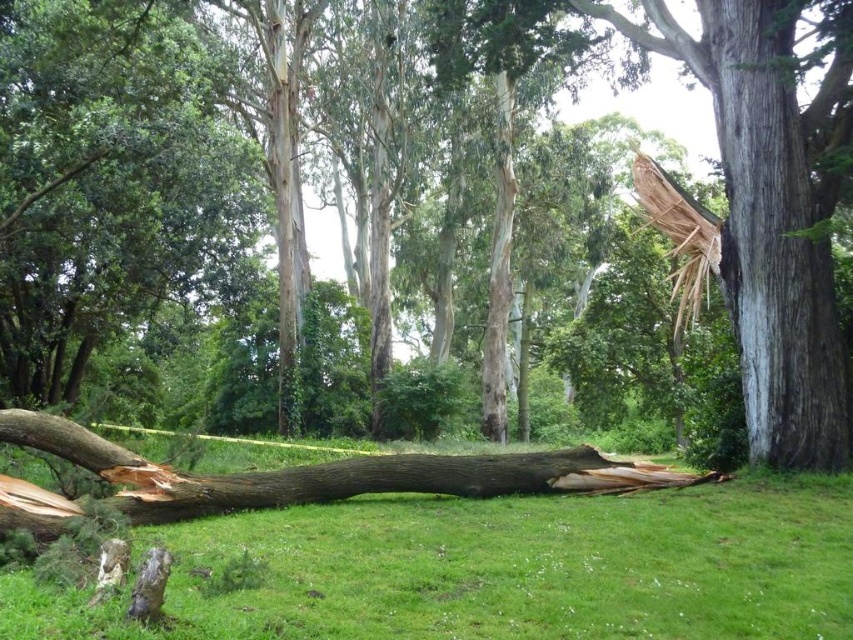
Question: Which object appears farthest from the camera in this image?

Choices:
 (A) brown rough tree trunk at center
 (B) green grass at center
 (C) brown rough wood at center
 (D) gray rough bark tree at right

Answer: (C)

Question: Which point is closer to the camera?

Choices:
 (A) brown rough tree trunk at center
 (B) green grass at center
 (C) gray rough bark tree at right

Answer: (A)

Question: Can you confirm if green grass at center is wider than gray rough bark tree at right?

Choices:
 (A) yes
 (B) no

Answer: (A)

Question: Is brown rough wood at center wider than brown rough tree trunk at center?

Choices:
 (A) yes
 (B) no

Answer: (B)

Question: Can you confirm if gray rough bark tree at right is positioned below brown rough tree trunk at center?

Choices:
 (A) no
 (B) yes

Answer: (A)

Question: Which point is closer to the camera?

Choices:
 (A) (815, 184)
 (B) (721, 134)

Answer: (A)